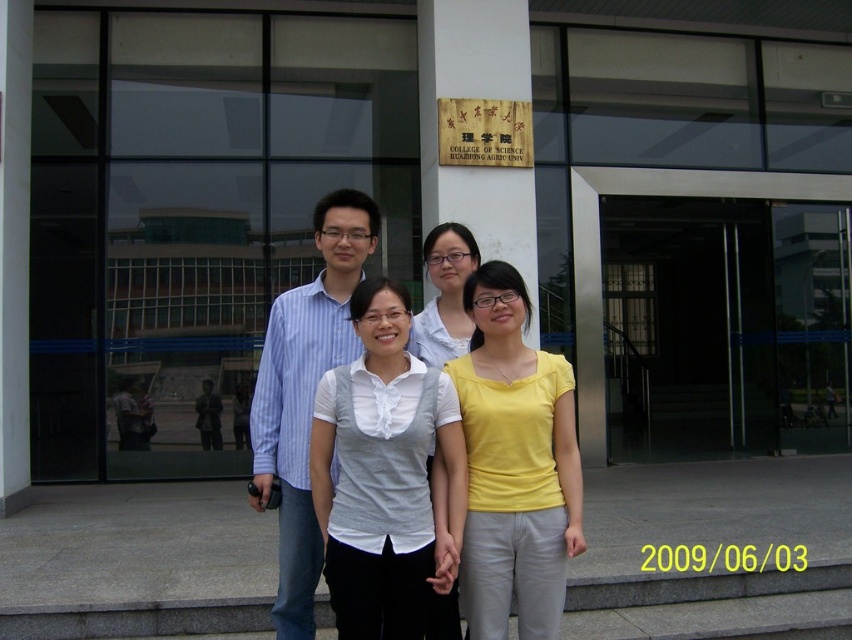
In the scene shown: Who is more distant from viewer, (321,392) or (306,625)?

The point (306,625) is behind.

Where is `white matte shirt at center`? white matte shirt at center is located at coordinates (384, 481).

Does white matte shirt at center appear over matte white blouse at center?

No, white matte shirt at center is not above matte white blouse at center.

Does white matte shirt at center have a greater width compared to matte white blouse at center?

Yes.

The width and height of the screenshot is (852, 640). Find the location of `white matte shirt at center`. white matte shirt at center is located at coordinates (384, 481).

Can you confirm if white matte shirt at center is positioned to the right of yellow matte shirt at center?

No, white matte shirt at center is not to the right of yellow matte shirt at center.

Is white matte shirt at center bigger than yellow matte shirt at center?

No, white matte shirt at center is not bigger than yellow matte shirt at center.

Where is `white matte shirt at center`? This screenshot has width=852, height=640. white matte shirt at center is located at coordinates (384, 481).

Where is `white matte shirt at center`? This screenshot has width=852, height=640. white matte shirt at center is located at coordinates (384, 481).